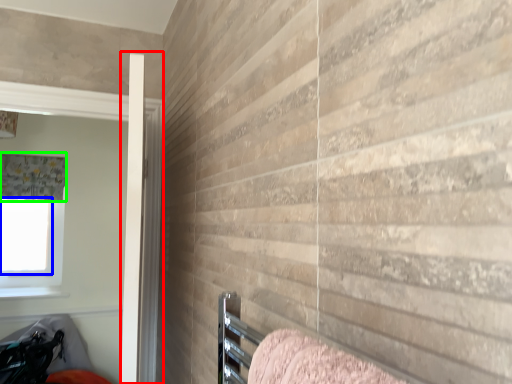
Question: Based on their relative distances, which object is nearer to screen door (highlighted by a red box)? Choose from window screen (highlighted by a blue box) and curtain (highlighted by a green box).

Choices:
 (A) window screen
 (B) curtain

Answer: (B)